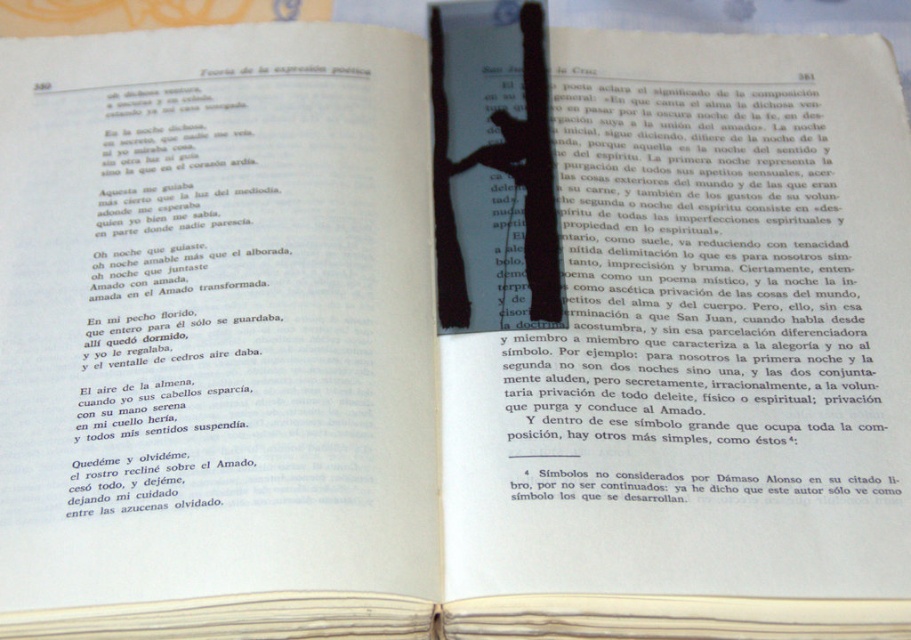
You are a student trying to read the open book with text in Spanish. The book has a black paper at upper center and a black paper bookmark at center. Which object is closer to the top of the book?

The black paper at upper center is closer to the top of the book than the black paper bookmark at center, so the black paper at upper center is the one nearer to the top.